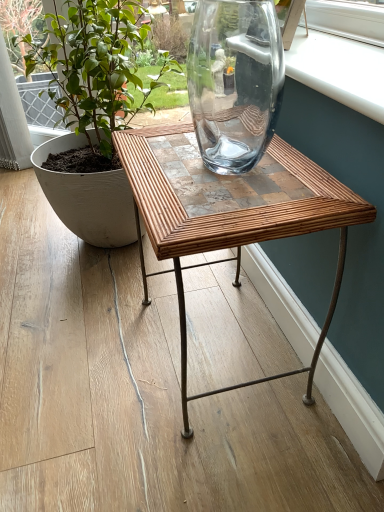
This screenshot has height=512, width=384. In order to click on vacant space that is to the left of bamboowoodentable at center in this screenshot , I will do `click(87, 361)`.